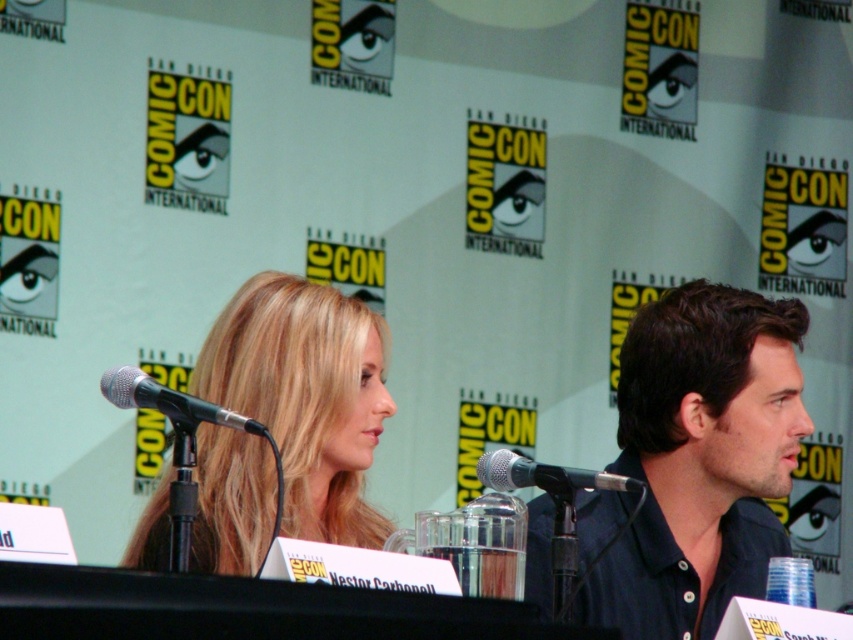
You are an attendee at the Comic Con panel. You notice the dark blue shirt at right and the black metallic microphone at center. Which object is closer to the bottom of the image?

The dark blue shirt at right is closer to the bottom of the image because it is below the black metallic microphone at center.

You are a photographer at the Comic Con panel discussion. You need to position a light source between the two points marked as point (148, 531) and point (111, 387). Which point should the light be closer to in order to ensure it illuminates both speakers evenly?

The light should be placed closer to point (111, 387) because point (148, 531) is further to the viewer than point (111, 387), so balancing the distance would require the light to compensate for the depth difference.

You are an event organizer at Comic Con and need to ensure that all microphones are visible to the audience. Given the dark blue shirt at right and the black metallic microphone at center, which object is more likely to be obscured by the other? Please explain your reasoning based on their sizes.

The black metallic microphone at center is smaller than the dark blue shirt at right. Since the dark blue shirt at right is larger, it could potentially obscure the microphone if positioned in a way that the shirt overlaps or blocks the view of the microphone from the audience.